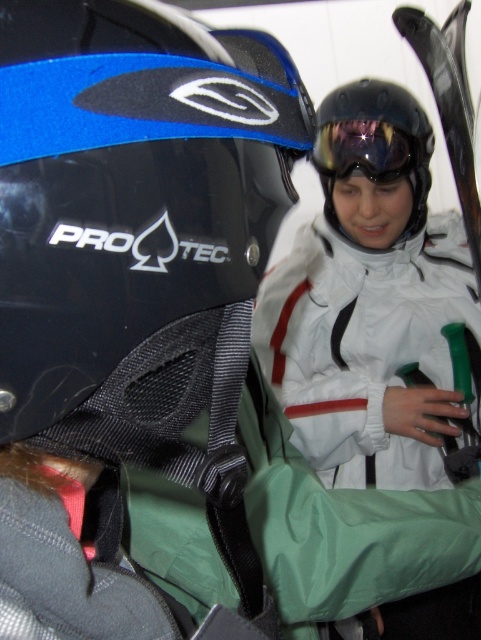
You are standing in a snowy area and see two people preparing for winter sports. There is a point at coordinates [374,145]. What object is located at this point?

The point at coordinates [374,145] corresponds to the glossy black helmet at upper center.

You are standing at the origin point of the image coordinate system. The point coordinates are given as follows. Which object is located at point (x=130, y=189)?

The black matte helmet at left is located at point (x=130, y=189).

You are standing in front of the snowy scene and want to take a photo. Which of the two points, point [125,317] or point [286,401], will appear larger in your camera view?

Point [125,317] will appear larger in the camera view because it is closer to the camera than point [286,401].